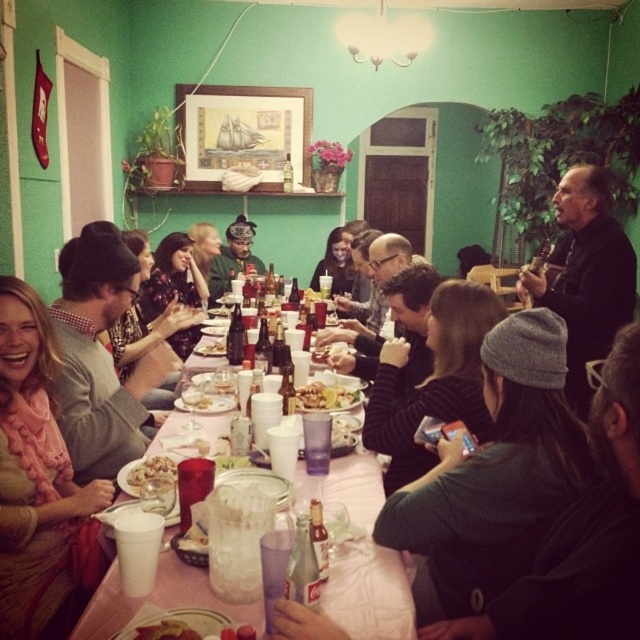
You are organizing a small party and need to place a decorative item on the table. The gray knit cap at center and the black leather jacket at upper right are both candidates. Which one has a larger width and would take up more space on the table?

The gray knit cap at center has a larger width than the black leather jacket at upper right, so it would take up more space on the table.

You are a guest at this table and want to reach for the golden brown bread at table center. However, there is a yellowish matte food at center in your way. Which direction should you move your hand to access the bread?

The yellowish matte food at center is to the right of the golden brown bread at table center, so you should move your hand to the left to access the bread.